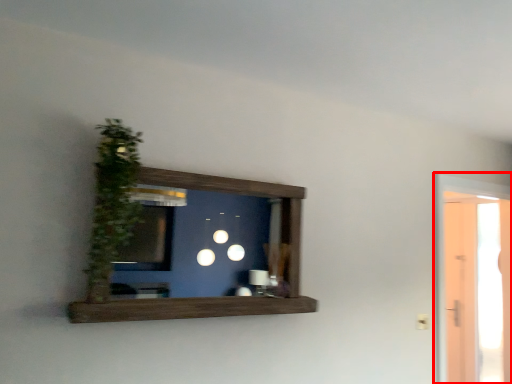
Question: From the image's perspective, what is the correct spatial positioning of glass door (annotated by the red box) in reference to plant?

Choices:
 (A) below
 (B) above

Answer: (A)